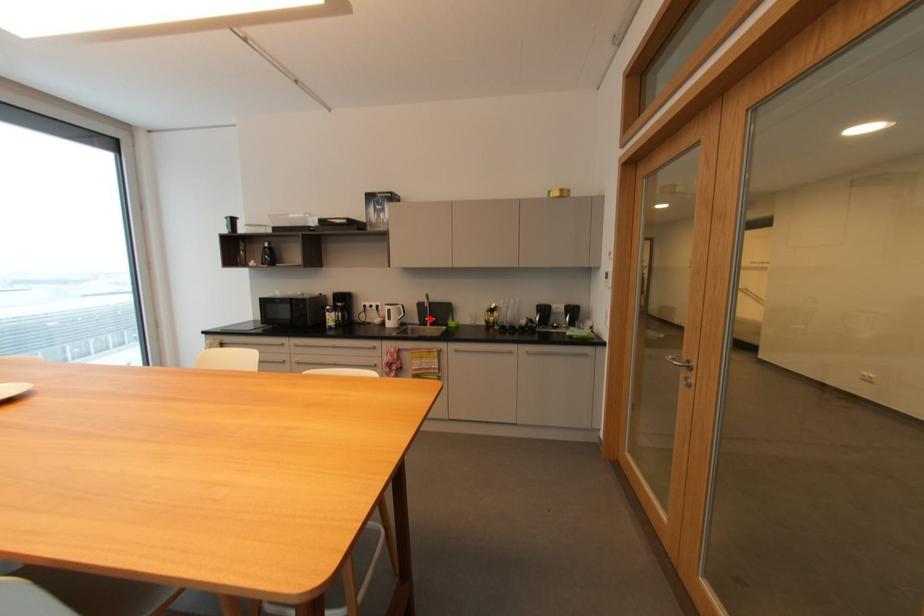
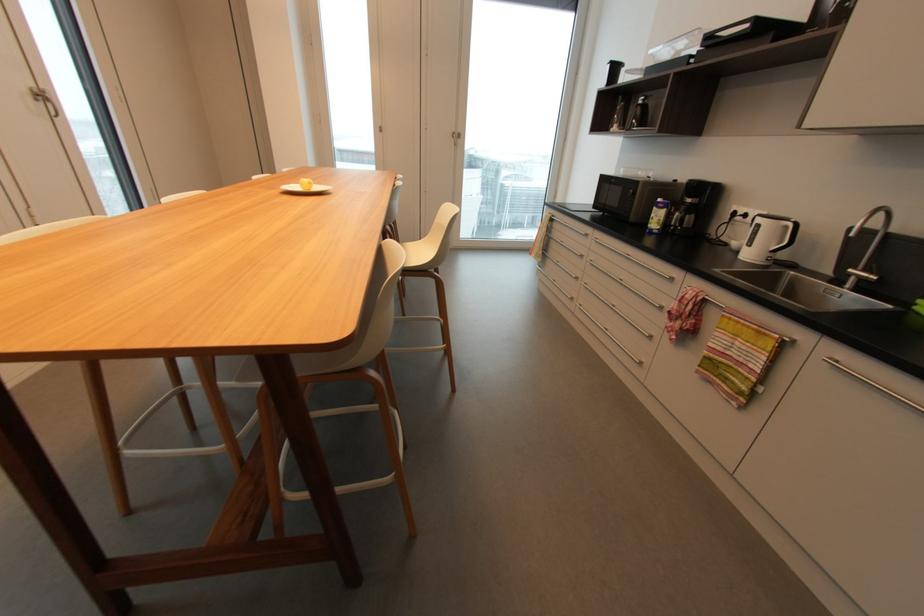
Question: I am providing you with two images of the same scene from different viewpoints. Given a red point in image1, look at the same physical point in image2. Is it:

Choices:
 (A) Closer to the viewpoint
 (B) Farther from the viewpoint

Answer: (B)